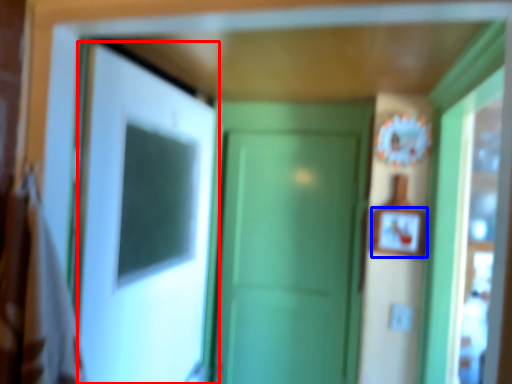
Question: Which object appears farthest to the camera in this image, door (highlighted by a red box) or picture frame (highlighted by a blue box)?

Choices:
 (A) door
 (B) picture frame

Answer: (B)